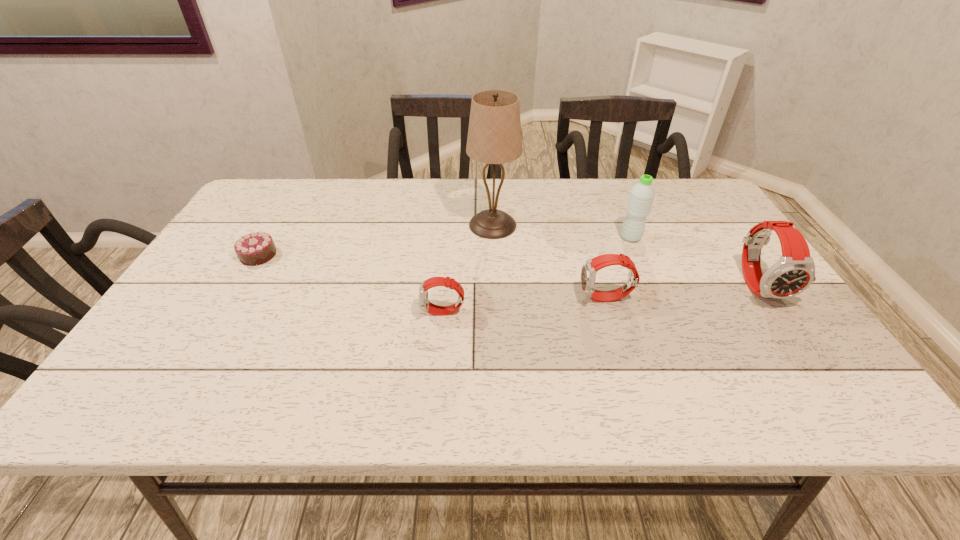
Find the location of a particular element. vacant space at the near right corner is located at coordinates (773, 344).

You are a GUI agent. You are given a task and a screenshot of the screen. Output one action in this format:
    pyautogui.click(x=<x>, y=<y>)
    Task: Click on the free spot between the second tallest watch and the shortest object
    
    Given the screenshot: What is the action you would take?
    pyautogui.click(x=432, y=276)

Find the location of `free space between the lampshade and the third object from right to left`. free space between the lampshade and the third object from right to left is located at coordinates (549, 262).

The height and width of the screenshot is (540, 960). In order to click on empty space that is in between the second object from right to left and the second watch from left to right in this screenshot , I will do `click(618, 268)`.

You are a GUI agent. You are given a task and a screenshot of the screen. Output one action in this format:
    pyautogui.click(x=<x>, y=<y>)
    Task: Click on the vacant area that lies between the tallest object and the water bottle
    
    Given the screenshot: What is the action you would take?
    pyautogui.click(x=562, y=231)

The width and height of the screenshot is (960, 540). Find the location of `free spot between the chocolate cake and the rightmost watch`. free spot between the chocolate cake and the rightmost watch is located at coordinates (509, 270).

At what (x,y) coordinates should I click in order to perform the action: click on free space between the fourth object from left to right and the shortest object. Please return your answer as a coordinate pair (x, y). This screenshot has height=540, width=960. Looking at the image, I should click on (432, 276).

I want to click on vacant space that's between the fifth object from left to right and the leftmost object, so click(444, 246).

The width and height of the screenshot is (960, 540). Find the location of `free space between the leftmost object and the fifth tallest object`. free space between the leftmost object and the fifth tallest object is located at coordinates (351, 284).

At what (x,y) coordinates should I click in order to perform the action: click on vacant area that lies between the fourth object from left to right and the water bottle. Please return your answer as a coordinate pair (x, y). Looking at the image, I should click on (618, 268).